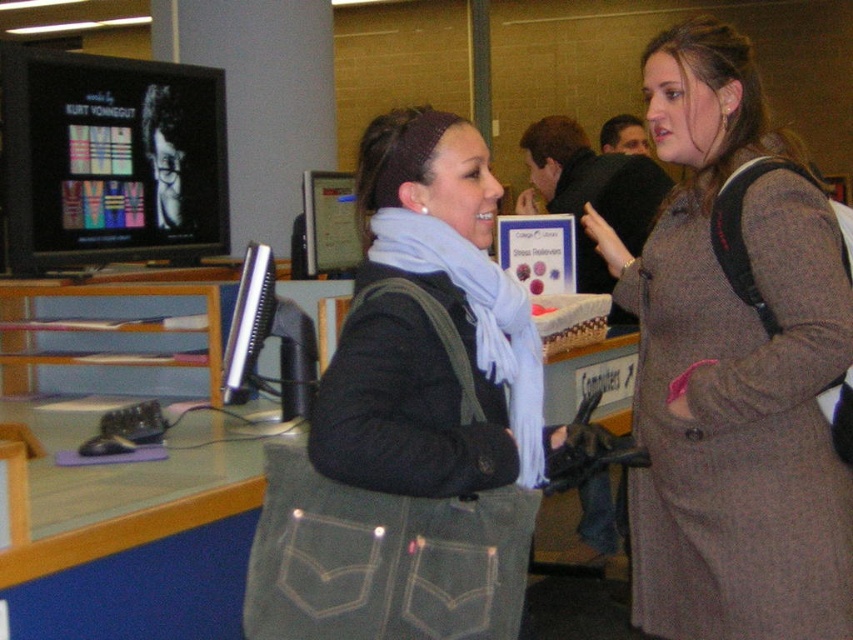
You are trying to determine which object is taller between the matte black jacket at center and the matte black monitor at upper left. Based on the scene description, which one is taller?

The matte black jacket at center is taller than the matte black monitor at upper left according to the description.

You are a tailor who needs to determine which coat to alter first. Since both the gray wool coat at center and the matte black jacket at center are in your shop, which one is covering the other and thus needs to be addressed first?

The gray wool coat at center is positioned over matte black jacket at center, so it needs to be addressed first as it is covering the other.

You are a photographer trying to capture a photo of the matte black monitor at upper left without including the matte black jacket at center in the frame. Is it possible to do so by adjusting your camera angle upwards?

Yes, since the matte black jacket at center is below the matte black monitor at upper left, tilting the camera upwards would allow you to frame the monitor without the jacket obstructing it.